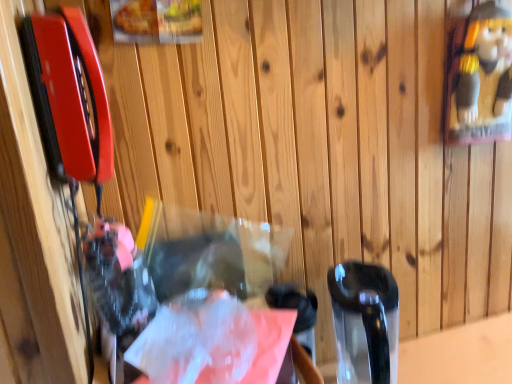
Question: In terms of height, does translucent plastic bag at center look taller or shorter compared to translucent plastic bag at center?

Choices:
 (A) tall
 (B) short

Answer: (B)

Question: From a real-world perspective, is translucent plastic bag at center physically located above or below translucent plastic bag at center?

Choices:
 (A) above
 (B) below

Answer: (A)

Question: Do you think translucent plastic bag at center is within translucent plastic bag at center, or outside of it?

Choices:
 (A) outside
 (B) inside

Answer: (A)

Question: Is translucent plastic bag at center taller or shorter than translucent plastic bag at center?

Choices:
 (A) tall
 (B) short

Answer: (A)

Question: Considering their positions, is translucent plastic bag at center located in front of or behind translucent plastic bag at center?

Choices:
 (A) front
 (B) behind

Answer: (A)

Question: Is translucent plastic bag at center situated inside translucent plastic bag at center or outside?

Choices:
 (A) inside
 (B) outside

Answer: (B)

Question: Does point (102, 294) appear closer or farther from the camera than point (181, 359)?

Choices:
 (A) farther
 (B) closer

Answer: (A)